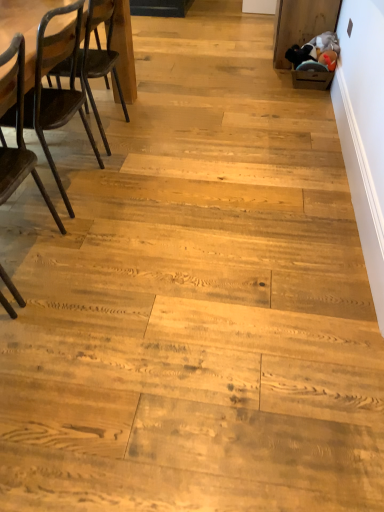
You are a GUI agent. You are given a task and a screenshot of the screen. Output one action in this format:
    pyautogui.click(x=<x>, y=<y>)
    Task: Click on the vacant space to the right of dark brown wood chair at left, the 2th chair viewed from the back
    
    Given the screenshot: What is the action you would take?
    pyautogui.click(x=110, y=268)